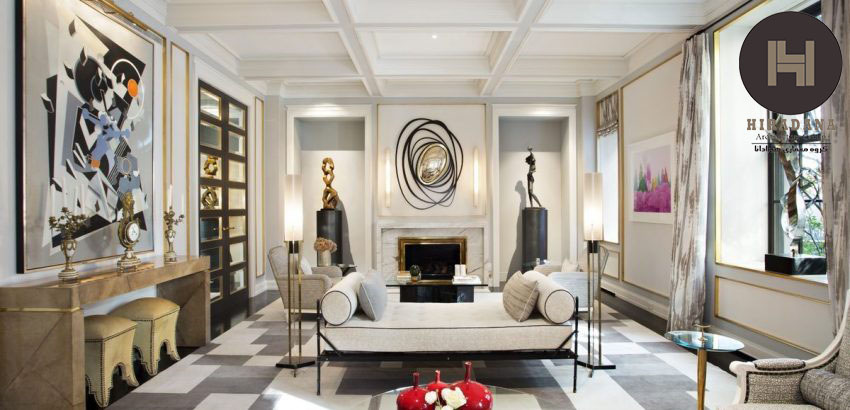
Where is `floor`? This screenshot has height=410, width=850. floor is located at coordinates (257, 370), (653, 358).